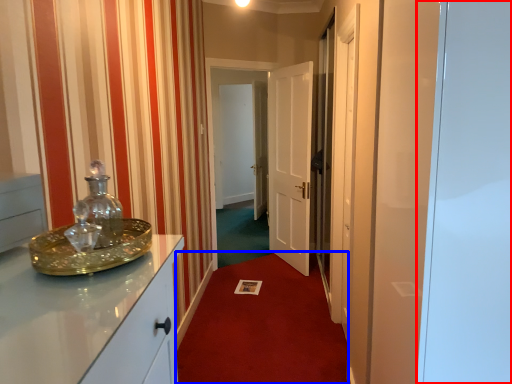
Question: Among these objects, which one is farthest to the camera, glass door (highlighted by a red box) or plain (highlighted by a blue box)?

Choices:
 (A) glass door
 (B) plain

Answer: (B)